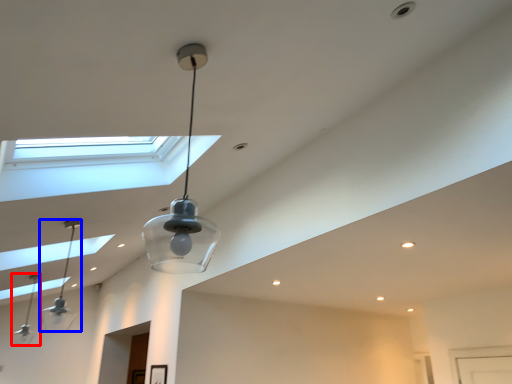
Question: Which point is closer to the camera, lamp (highlighted by a red box) or lamp (highlighted by a blue box)?

Choices:
 (A) lamp
 (B) lamp

Answer: (B)